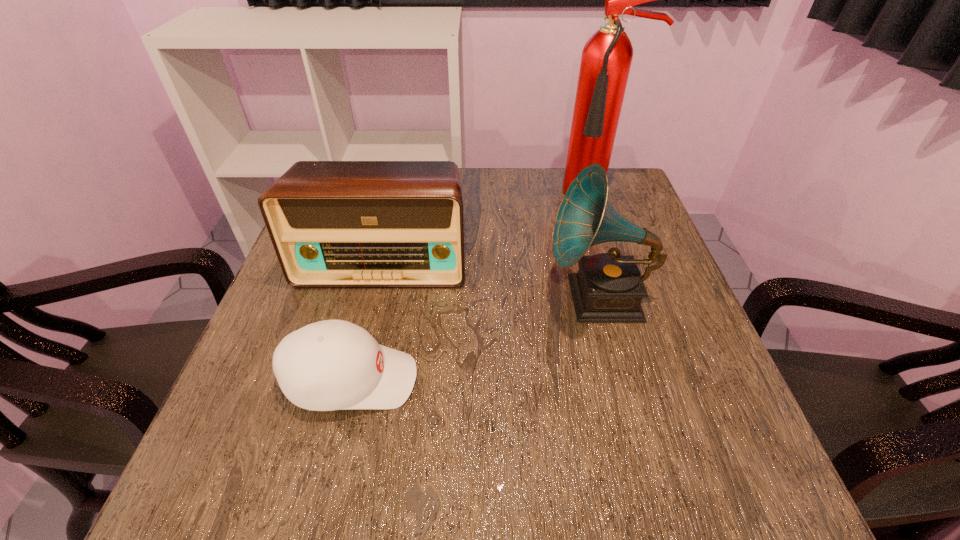
The image size is (960, 540). I want to click on vacant space in between the second tallest object and the nearest object, so click(x=475, y=339).

Where is `free space between the second tallest object and the fire extinguisher`? The width and height of the screenshot is (960, 540). free space between the second tallest object and the fire extinguisher is located at coordinates (598, 247).

Find the location of a particular element. free space between the baseball cap and the second shortest object is located at coordinates (367, 321).

Locate which object is the closest to the third shortest object. Please provide its 2D coordinates. Your answer should be formatted as a tuple, i.e. [(x, y)], where the tuple contains the x and y coordinates of a point satisfying the conditions above.

[(332, 223)]

Identify the location of the second closest object to the tallest object. The image size is (960, 540). (332, 223).

Where is `vacant region that satisfies the following two spatial constraints: 1. at the nozzle of the tallest object; 2. from the horn of the second tallest object`? This screenshot has width=960, height=540. vacant region that satisfies the following two spatial constraints: 1. at the nozzle of the tallest object; 2. from the horn of the second tallest object is located at coordinates (632, 298).

Find the location of a particular element. Image resolution: width=960 pixels, height=540 pixels. free space that satisfies the following two spatial constraints: 1. at the nozzle of the fire extinguisher; 2. on the front-facing side of the nearest object is located at coordinates (660, 380).

Find the location of `vacant position in the image that satisfies the following two spatial constraints: 1. at the nozzle of the fire extinguisher; 2. on the front-facing side of the shortest object`. vacant position in the image that satisfies the following two spatial constraints: 1. at the nozzle of the fire extinguisher; 2. on the front-facing side of the shortest object is located at coordinates (660, 380).

In order to click on vacant space that satisfies the following two spatial constraints: 1. on the front-facing side of the radio receiver; 2. on the front-facing side of the nearest object in this screenshot , I will do `click(355, 380)`.

Image resolution: width=960 pixels, height=540 pixels. I want to click on vacant position in the image that satisfies the following two spatial constraints: 1. at the nozzle of the farthest object; 2. on the front-facing side of the shortest object, so click(x=660, y=380).